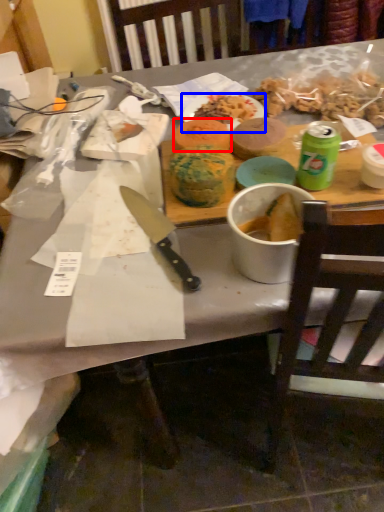
Question: Which object is closer to the camera taking this photo, food (highlighted by a red box) or plate (highlighted by a blue box)?

Choices:
 (A) food
 (B) plate

Answer: (A)